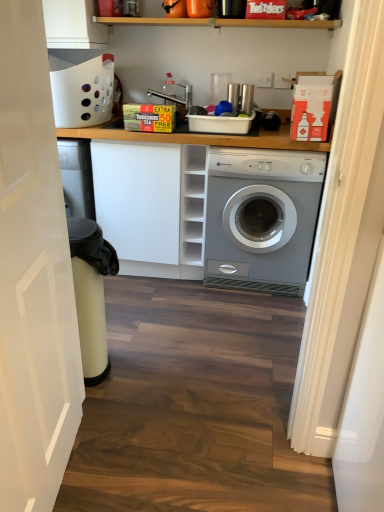
Question: Is white matte door at left outside white matte cabinet at center?

Choices:
 (A) no
 (B) yes

Answer: (B)

Question: Could you tell me if white matte door at left is facing white matte cabinet at center?

Choices:
 (A) yes
 (B) no

Answer: (B)

Question: Is white matte door at left far away from white matte cabinet at center?

Choices:
 (A) yes
 (B) no

Answer: (A)

Question: Considering the relative positions of white matte door at left and white matte cabinet at center in the image provided, is white matte door at left behind white matte cabinet at center?

Choices:
 (A) no
 (B) yes

Answer: (A)

Question: Does white matte door at left come in front of white matte cabinet at center?

Choices:
 (A) no
 (B) yes

Answer: (B)

Question: Does white matte door at left have a smaller size compared to white matte cabinet at center?

Choices:
 (A) yes
 (B) no

Answer: (A)

Question: Can you confirm if white matte door at left is bigger than silver metallic washing machine at center-right?

Choices:
 (A) no
 (B) yes

Answer: (A)

Question: Would you consider white matte door at left to be distant from silver metallic washing machine at center-right?

Choices:
 (A) yes
 (B) no

Answer: (A)

Question: Does white matte door at left have a smaller size compared to silver metallic washing machine at center-right?

Choices:
 (A) yes
 (B) no

Answer: (A)

Question: Is white matte door at left wider than silver metallic washing machine at center-right?

Choices:
 (A) yes
 (B) no

Answer: (B)

Question: Is white matte door at left at the left side of silver metallic washing machine at center-right?

Choices:
 (A) no
 (B) yes

Answer: (B)

Question: Is the depth of white matte door at left greater than that of silver metallic washing machine at center-right?

Choices:
 (A) yes
 (B) no

Answer: (B)

Question: Can you confirm if silver metallic washing machine at center-right is shorter than white matte cabinet at center?

Choices:
 (A) yes
 (B) no

Answer: (A)